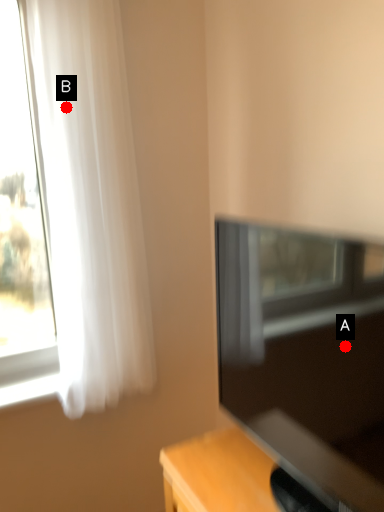
Question: Two points are circled on the image, labeled by A and B beside each circle. Which point is further to the camera?

Choices:
 (A) A is further
 (B) B is further

Answer: (B)